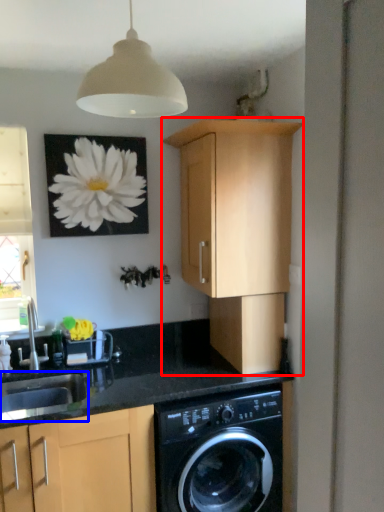
Question: Which of the following is the farthest to the observer, cabinetry (highlighted by a red box) or sink (highlighted by a blue box)?

Choices:
 (A) cabinetry
 (B) sink

Answer: (B)